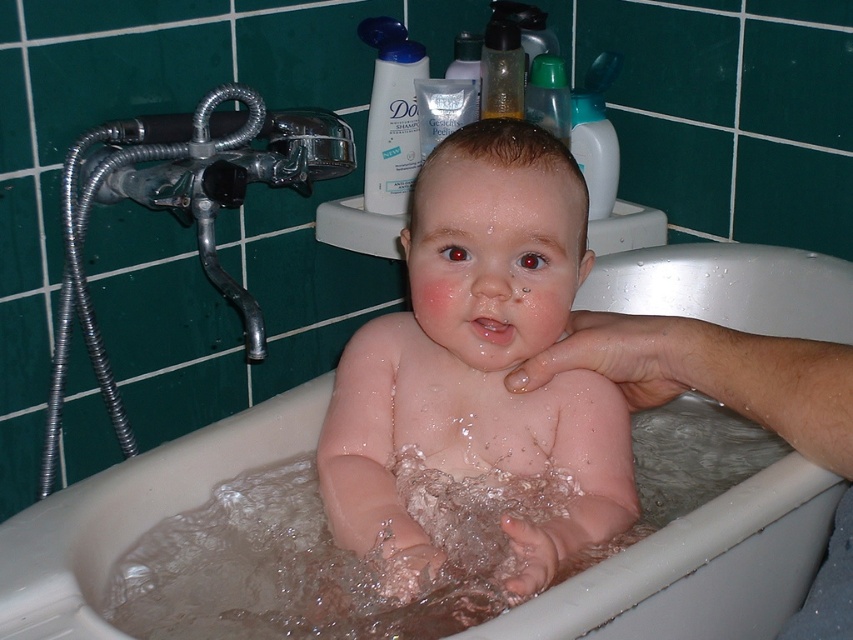
Which of these two, pink smooth skin at center or white plastic bathtub at center, stands taller?

Standing taller between the two is pink smooth skin at center.

Locate an element on the screen. This screenshot has height=640, width=853. pink smooth skin at center is located at coordinates (479, 364).

Is point (421, 561) closer to viewer compared to point (827, 282)?

Yes, point (421, 561) is closer to viewer.

Where is `pink smooth skin at center`? This screenshot has height=640, width=853. pink smooth skin at center is located at coordinates (479, 364).